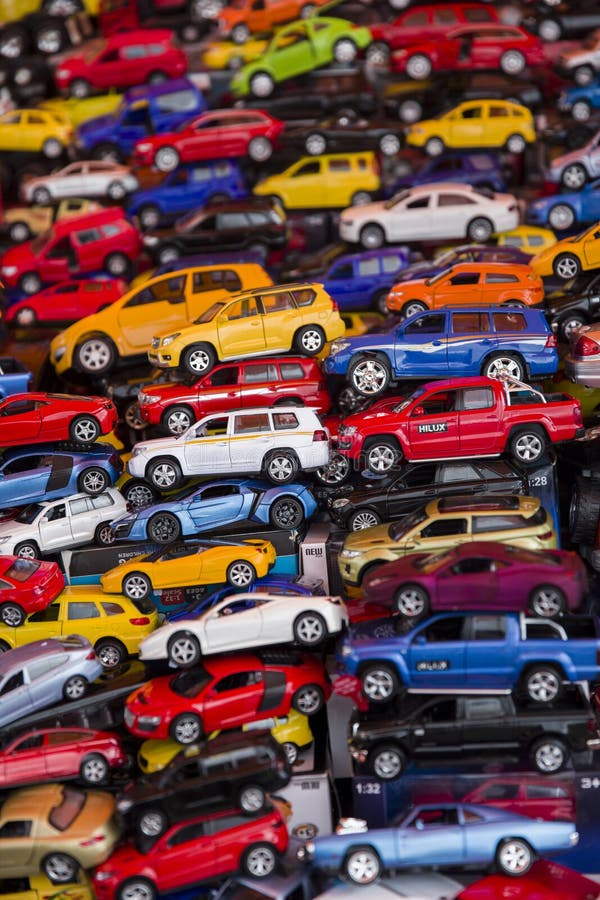
Locate an element on the screen. This screenshot has width=600, height=900. boxes is located at coordinates tap(311, 805), tap(377, 801), tap(594, 795), tap(368, 622), tap(316, 574), tap(336, 536), tap(290, 540).